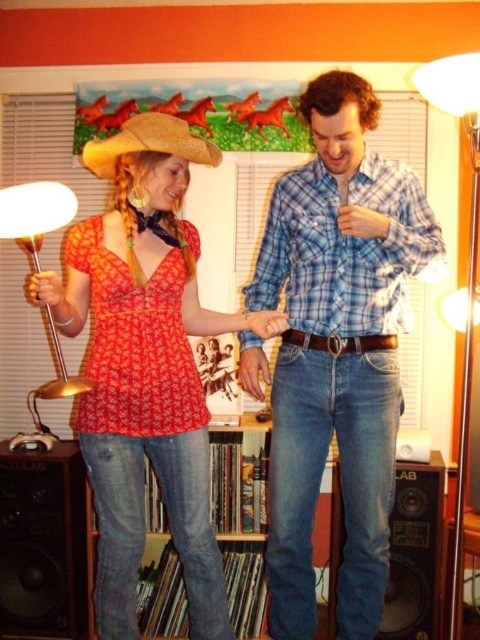
You are standing in the room and want to reach the point at coordinates (444, 77). If your maximum reach is 5 feet, will you be able to touch it?

The point at coordinates (444, 77) is 5.33 feet away from the viewer, which is beyond your maximum reach of 5 feet. Therefore, you cannot touch it.

You are planning to place a new decorative item on the shelf below the colorful painting of horses. You have a small decorative horse statue that is the same size as the strawhat at upper left. Will the matte gold floor lamp at right fit on the shelf if you place the horse statue next to it?

The matte gold floor lamp at right is bigger than the strawhat at upper left. Since the horse statue is the same size as the strawhat, the floor lamp may not fit on the shelf because it is larger than the statue. Check the shelf space carefully before placing both items.